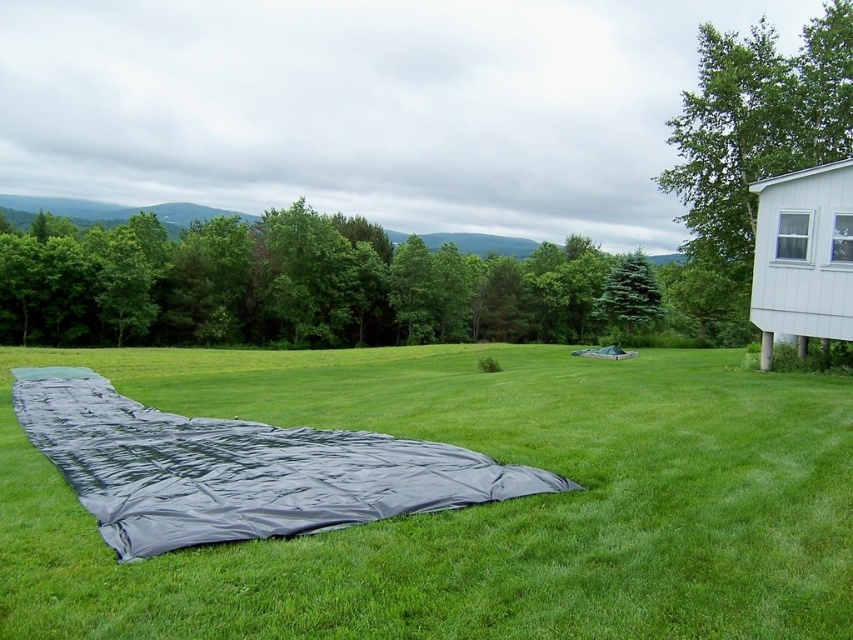
Question: Which point appears farthest from the camera in this image?

Choices:
 (A) (264, 449)
 (B) (793, 100)
 (C) (654, 291)

Answer: (C)

Question: Does green leafy tree at upper right appear on the right side of green matte evergreen tree at center-right?

Choices:
 (A) no
 (B) yes

Answer: (B)

Question: Does black tarp at center appear over green leafy tree at upper right?

Choices:
 (A) no
 (B) yes

Answer: (A)

Question: Which object is farther from the camera taking this photo?

Choices:
 (A) black tarp at center
 (B) green matte evergreen tree at center-right
 (C) green leafy tree at upper right

Answer: (B)

Question: Is black tarp at center to the right of green leafy tree at upper right from the viewer's perspective?

Choices:
 (A) yes
 (B) no

Answer: (B)

Question: Which of the following is the farthest from the observer?

Choices:
 (A) green leafy tree at upper right
 (B) green matte evergreen tree at center-right
 (C) black tarp at center

Answer: (B)